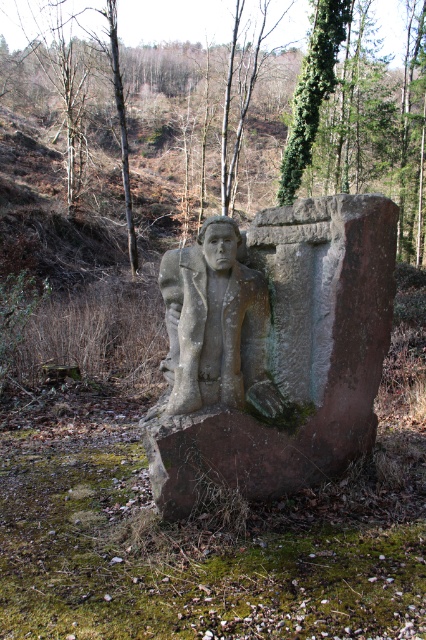
You are a photographer trying to capture both the stone statue at center and the green mossy tree at upper center in a single frame. Based on their positions, which object should you position closer to the left side of your camera frame?

The stone statue at center should be positioned closer to the left side of your camera frame because it is already located to the left of the green mossy tree at upper center in the scene.

Looking at the gray stone statue at center and the green mossy tree at upper center, which object is positioned to the right?

The green mossy tree at upper center is positioned to the right of the gray stone statue at center.

You are a landscape architect designing a new garden path that needs to pass between the stone statue at center and the green mossy tree at upper center. Given their sizes, which object requires more space to accommodate on the path?

The green mossy tree at upper center requires more space because it occupies more area than the stone statue at center according to the description.